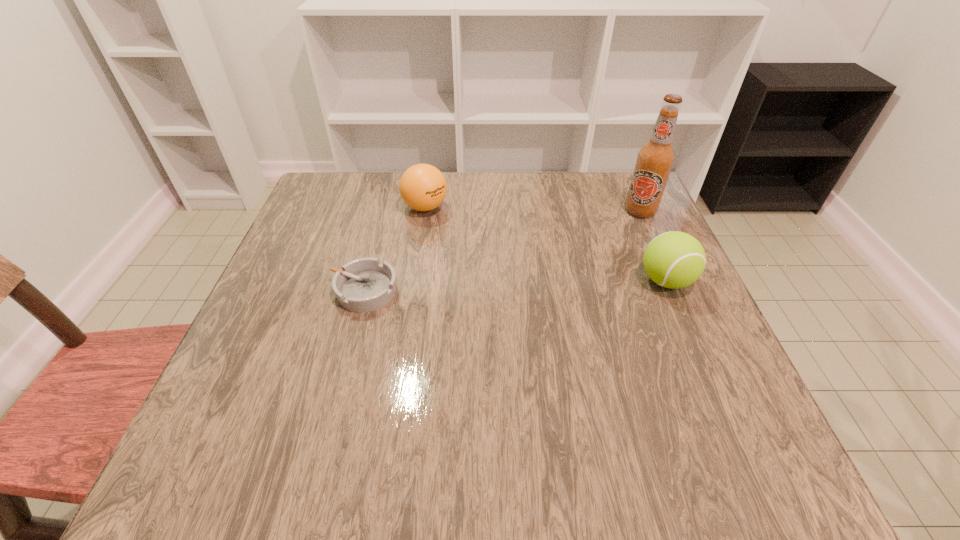
Locate an element on the screen. Image resolution: width=960 pixels, height=540 pixels. free space on the desktop that is between the shortest object and the tennis ball and is positioned on the front label of the beer bottle is located at coordinates (550, 285).

You are a GUI agent. You are given a task and a screenshot of the screen. Output one action in this format:
    pyautogui.click(x=<x>, y=<y>)
    Task: Click on the free space on the desktop that is between the ashtray and the tennis ball and is positioned on the side with brand of the ping-pong ball
    This screenshot has height=540, width=960.
    Given the screenshot: What is the action you would take?
    [474, 287]